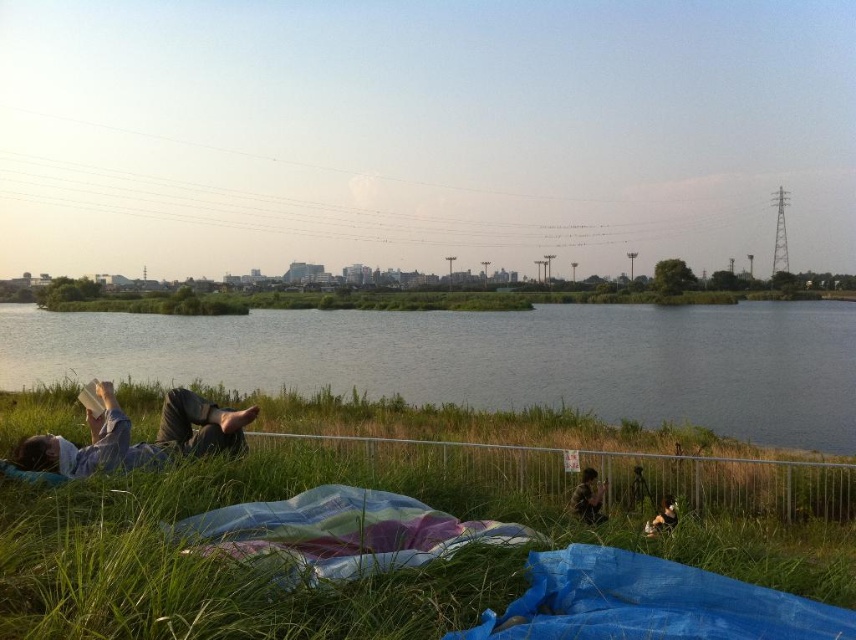
You are standing at the point labeled as point (319, 515) and want to walk towards the point labeled as point (247, 637). Which direction should you face to move directly towards your destination?

To move directly from point (319, 515) to point (247, 637), you should face towards the northeast direction since the destination point is northeast of the starting point.

You are standing at the point labeled point (657, 529) and want to walk to the point labeled point (643, 352). Which direction should you face to move towards your destination?

You should face towards the direction of point (643, 352), which is behind point (657, 529), so you need to walk backwards or turn around to move towards it.

You are standing at the center of the image and want to place a new picnic basket. The basket needs to be placed in an area that is not occupied by any objects and is closest to the green grassy at lower left. Where should you place it?

The green grassy at lower left is located at point [321,588]. Since the basket must be placed closest to this area without overlapping any objects, the ideal spot would be just adjacent to the green grassy at lower left, ensuring no other objects are in that vicinity.